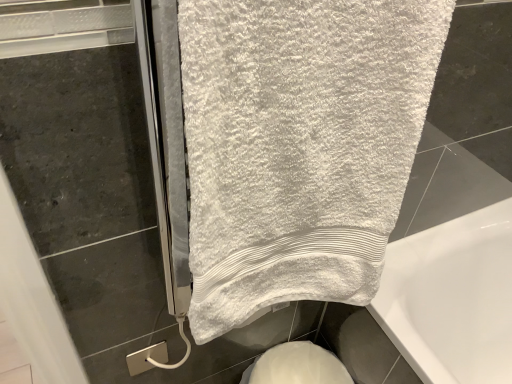
You are a GUI agent. You are given a task and a screenshot of the screen. Output one action in this format:
    pyautogui.click(x=<x>, y=<y>)
    Task: Click on the white glossy bidet at lower center
    The width and height of the screenshot is (512, 384).
    Given the screenshot: What is the action you would take?
    pyautogui.click(x=297, y=366)

The width and height of the screenshot is (512, 384). What do you see at coordinates (297, 366) in the screenshot?
I see `white glossy bidet at lower center` at bounding box center [297, 366].

Image resolution: width=512 pixels, height=384 pixels. What do you see at coordinates (298, 145) in the screenshot?
I see `white soft towel at upper center` at bounding box center [298, 145].

The width and height of the screenshot is (512, 384). I want to click on white soft towel at upper center, so click(298, 145).

Locate an element on the screen. The height and width of the screenshot is (384, 512). white glossy bidet at lower center is located at coordinates (297, 366).

In the image, is white glossy bidet at lower center on the left side or the right side of white soft towel at upper center?

From the image, it's evident that white glossy bidet at lower center is to the right of white soft towel at upper center.

Which object is more forward, white glossy bidet at lower center or white soft towel at upper center?

white soft towel at upper center.

Is point (284, 371) in front of point (286, 7)?

No, (284, 371) is further to viewer.

From the image's perspective, is white glossy bidet at lower center under white soft towel at upper center?

Yes.

From a real-world perspective, is white glossy bidet at lower center above or below white soft towel at upper center?

In terms of real-world spatial position, white glossy bidet at lower center is below white soft towel at upper center.

Considering the relative sizes of white glossy bidet at lower center and white soft towel at upper center in the image provided, is white glossy bidet at lower center thinner than white soft towel at upper center?

Indeed, white glossy bidet at lower center has a lesser width compared to white soft towel at upper center.

In terms of height, does white glossy bidet at lower center look taller or shorter compared to white soft towel at upper center?

Clearly, white glossy bidet at lower center is shorter compared to white soft towel at upper center.

In terms of size, does white glossy bidet at lower center appear bigger or smaller than white soft towel at upper center?

In the image, white glossy bidet at lower center appears to be smaller than white soft towel at upper center.

Is white soft towel at upper center surrounded by white glossy bidet at lower center?

No.

Is the surface of white glossy bidet at lower center in direct contact with white soft towel at upper center?

No, white glossy bidet at lower center is not beside white soft towel at upper center.

Is white glossy bidet at lower center aimed at white soft towel at upper center?

No, white glossy bidet at lower center is not oriented towards white soft towel at upper center.

Where is `bidet lying behind the white soft towel at upper center`? The height and width of the screenshot is (384, 512). bidet lying behind the white soft towel at upper center is located at coordinates pyautogui.click(x=297, y=366).

Is white soft towel at upper center to the left of white glossy bidet at lower center from the viewer's perspective?

Yes.

Which object is further away from the camera taking this photo, white soft towel at upper center or white glossy bidet at lower center?

Positioned behind is white glossy bidet at lower center.

Which is behind, point (225, 217) or point (334, 358)?

Point (334, 358)

In the scene shown: From the image's perspective, is white soft towel at upper center above or below white glossy bidet at lower center?

white soft towel at upper center is above white glossy bidet at lower center.

From the picture: From a real-world perspective, is white soft towel at upper center over white glossy bidet at lower center?

Yes, from a real-world perspective, white soft towel at upper center is above white glossy bidet at lower center.

Does white soft towel at upper center have a greater width compared to white glossy bidet at lower center?

Yes, white soft towel at upper center is wider than white glossy bidet at lower center.

Looking at this image, who is shorter, white soft towel at upper center or white glossy bidet at lower center?

white glossy bidet at lower center is shorter.

Between white soft towel at upper center and white glossy bidet at lower center, which one has smaller size?

Smaller between the two is white glossy bidet at lower center.

Choose the correct answer: Is white soft towel at upper center inside white glossy bidet at lower center or outside it?

white soft towel at upper center is outside white glossy bidet at lower center.

Can you see white soft towel at upper center touching white glossy bidet at lower center?

white soft towel at upper center and white glossy bidet at lower center are clearly separated.

Is white soft towel at upper center oriented towards white glossy bidet at lower center?

No.

What's the angular difference between white soft towel at upper center and white glossy bidet at lower center's facing directions?

They differ by 1.82 degrees in their facing directions.

Find the location of a particular element. The height and width of the screenshot is (384, 512). towel above the white glossy bidet at lower center (from a real-world perspective) is located at coordinates (298, 145).

This screenshot has height=384, width=512. What are the coordinates of `towel above the white glossy bidet at lower center (from the image's perspective)` in the screenshot? It's located at (298, 145).

Find the location of a particular element. bidet below the white soft towel at upper center (from a real-world perspective) is located at coordinates (297, 366).